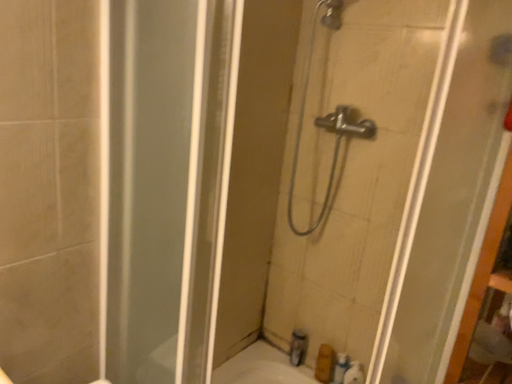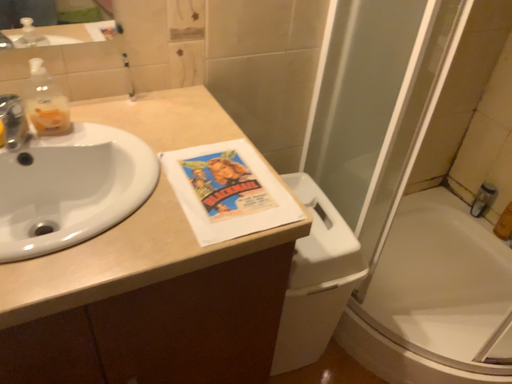
Question: How did the camera likely rotate when shooting the video?

Choices:
 (A) rotated right
 (B) rotated left

Answer: (B)